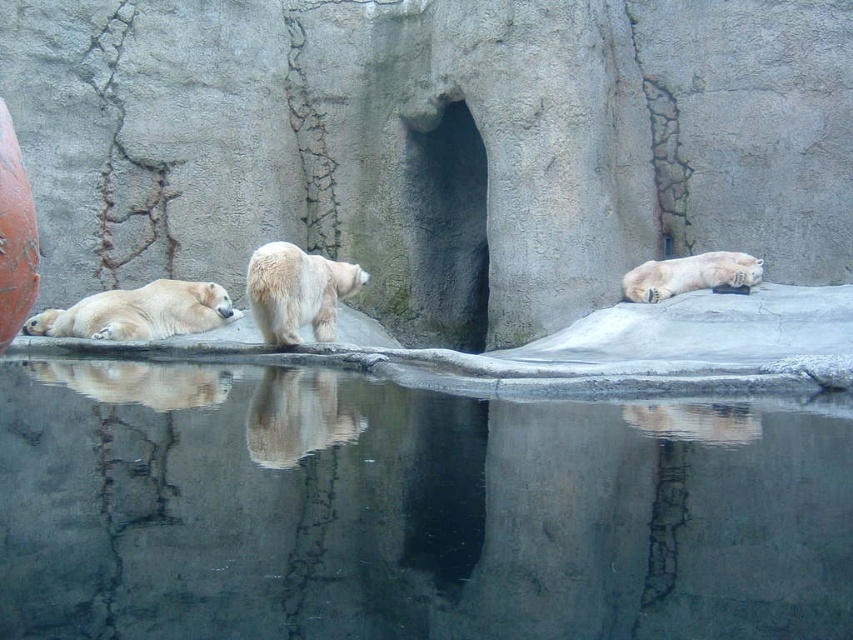
You are a zookeeper standing at the entrance of the polar bear enclosure. You need to observe both the white fur polar bear at center and the white fur bear at upper right. Which bear do you have to look at first if you want to see the one closer to you?

The white fur polar bear at center is closer to the viewer, so you should look at it first.

You are a zookeeper who needs to observe the white fur polar bear at center from the left side. The bears are 7.35 meters apart. Can you safely walk between them without getting too close to the other bears?

The distance between the white fur polar bear at center and the other bears is 7.35 meters, which is sufficient for a zookeeper to walk between them safely without getting too close.